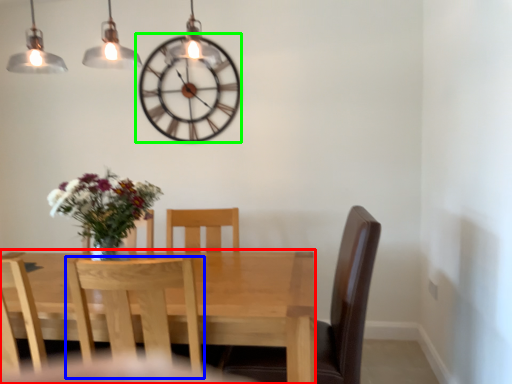
Question: Which object is positioned closest to kitchen & dining room table (highlighted by a red box)? Select from chair (highlighted by a blue box) and wall clock (highlighted by a green box).

Choices:
 (A) chair
 (B) wall clock

Answer: (A)